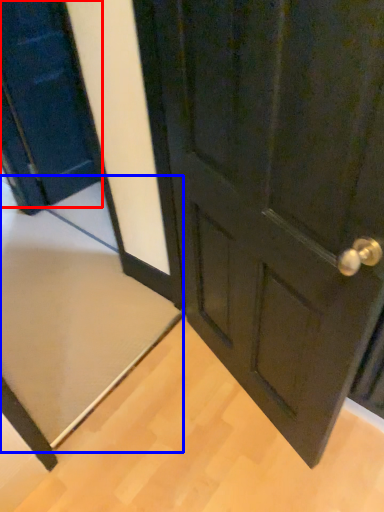
Question: Which of the following is the closest to the observer, door (highlighted by a red box) or doormat (highlighted by a blue box)?

Choices:
 (A) door
 (B) doormat

Answer: (A)